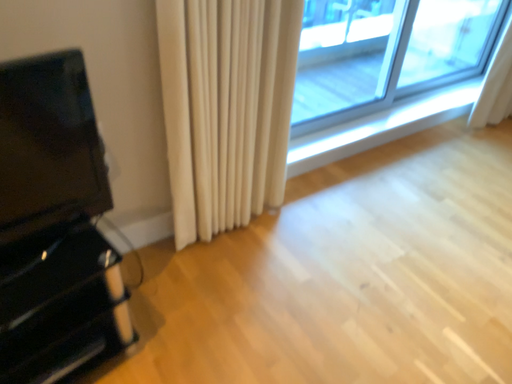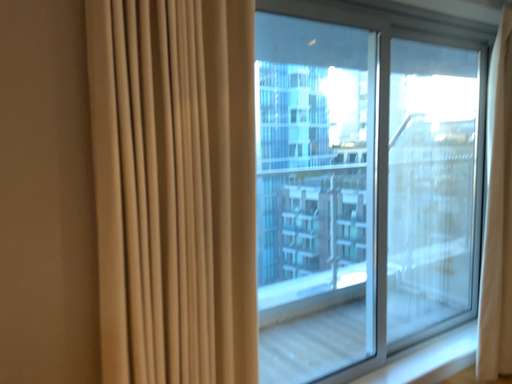
Question: How did the camera likely rotate when shooting the video?

Choices:
 (A) rotated upward
 (B) rotated downward

Answer: (A)